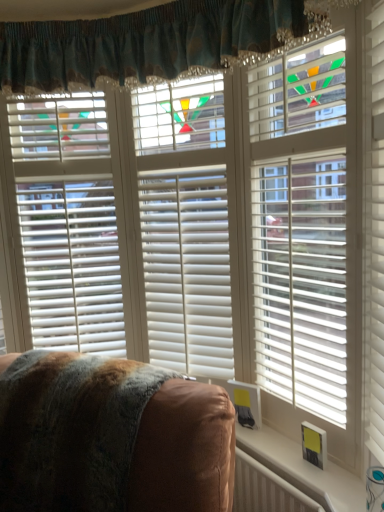
Question: Can you confirm if white matte blinds at right, which is counted as the 3th blind, starting from the left, is wider than white plastic radiator at lower right?

Choices:
 (A) yes
 (B) no

Answer: (A)

Question: From the image's perspective, is white matte blinds at right, which is counted as the 1th blind, starting from the right, beneath white plastic radiator at lower right?

Choices:
 (A) no
 (B) yes

Answer: (A)

Question: Considering the relative positions of white matte blinds at right, which is counted as the 1th blind, starting from the right, and white plastic radiator at lower right in the image provided, is white matte blinds at right, which is counted as the 1th blind, starting from the right, to the left of white plastic radiator at lower right from the viewer's perspective?

Choices:
 (A) no
 (B) yes

Answer: (A)

Question: Is white matte blinds at right, which is counted as the 3th blind, starting from the left, oriented towards white plastic radiator at lower right?

Choices:
 (A) no
 (B) yes

Answer: (A)

Question: Is white matte blinds at right, which is counted as the 3th blind, starting from the left, shorter than white plastic radiator at lower right?

Choices:
 (A) no
 (B) yes

Answer: (A)

Question: From a real-world perspective, is white plastic radiator at lower right positioned above or below white plastic radiator at lower right?

Choices:
 (A) below
 (B) above

Answer: (B)

Question: Is white plastic radiator at lower right taller or shorter than white plastic radiator at lower right?

Choices:
 (A) short
 (B) tall

Answer: (A)

Question: Is point (342, 505) positioned closer to the camera than point (269, 485)?

Choices:
 (A) farther
 (B) closer

Answer: (B)

Question: From the image's perspective, is white plastic radiator at lower right located above or below white plastic radiator at lower right?

Choices:
 (A) below
 (B) above

Answer: (B)

Question: Do you think white wood blinds at left, marked as the 1th blind in a left-to-right arrangement, is within white matte blinds at center, the 2th blind positioned from the right, or outside of it?

Choices:
 (A) inside
 (B) outside

Answer: (B)

Question: In the image, is white wood blinds at left, marked as the 1th blind in a left-to-right arrangement, positioned in front of or behind white matte blinds at center, positioned as the 2th blind in left-to-right order?

Choices:
 (A) behind
 (B) front

Answer: (A)

Question: From a real-world perspective, is white wood blinds at left, marked as the 1th blind in a left-to-right arrangement, positioned above or below white matte blinds at center, positioned as the 2th blind in left-to-right order?

Choices:
 (A) above
 (B) below

Answer: (A)

Question: Is white wood blinds at left, placed as the 3th blind when sorted from right to left, taller or shorter than white matte blinds at center, the 2th blind positioned from the right?

Choices:
 (A) tall
 (B) short

Answer: (B)

Question: Which is correct: white plastic radiator at lower right is inside white matte blinds at right, which is counted as the 3th blind, starting from the left, or outside of it?

Choices:
 (A) inside
 (B) outside

Answer: (B)

Question: From a real-world perspective, is white plastic radiator at lower right physically located above or below white matte blinds at right, which is counted as the 1th blind, starting from the right?

Choices:
 (A) above
 (B) below

Answer: (B)